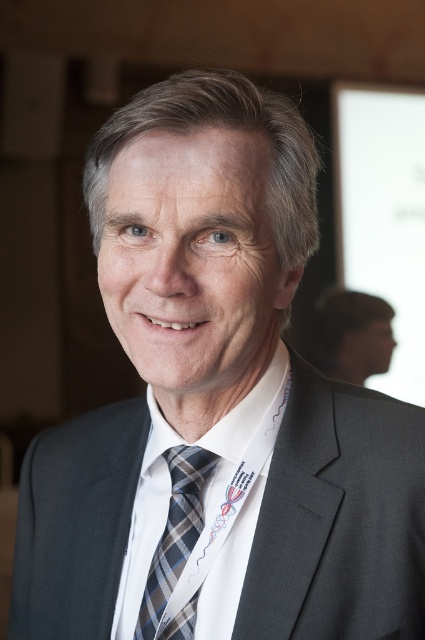
Question: Can you confirm if white woven dress shirt at center is positioned to the right of plaid silk tie at center?

Choices:
 (A) no
 (B) yes

Answer: (B)

Question: Which of the following is the closest to the observer?

Choices:
 (A) (336, 340)
 (B) (181, 593)

Answer: (B)

Question: Which object appears closest to the camera in this image?

Choices:
 (A) matte black suit at right
 (B) white woven dress shirt at center

Answer: (B)

Question: Considering the relative positions of plaid silk tie at center and matte black suit at right in the image provided, where is plaid silk tie at center located with respect to matte black suit at right?

Choices:
 (A) below
 (B) above

Answer: (A)

Question: Based on their relative distances, which object is nearer to the plaid silk tie at center?

Choices:
 (A) matte black suit at right
 (B) white woven dress shirt at center

Answer: (B)

Question: Does plaid silk tie at center appear over matte black suit at right?

Choices:
 (A) no
 (B) yes

Answer: (A)